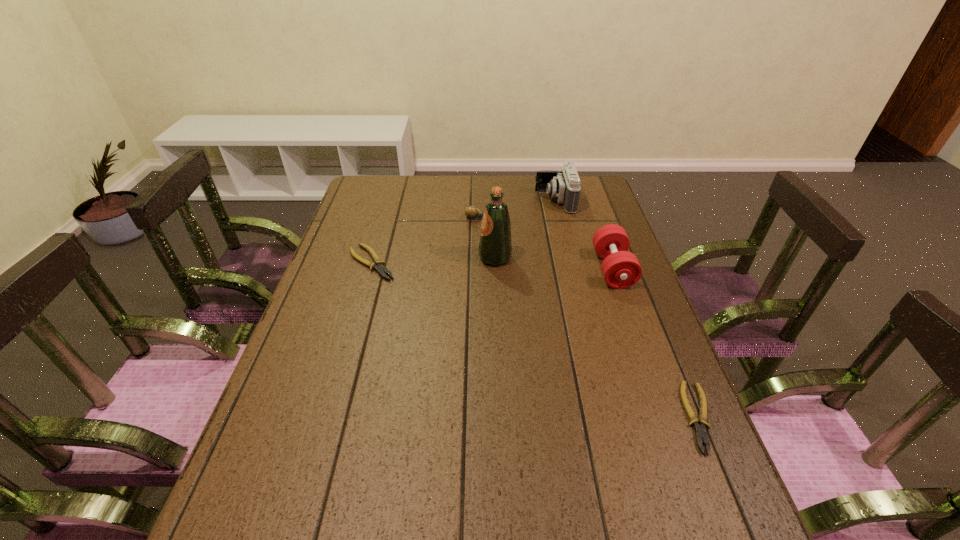
At what (x,y) coordinates should I click in order to perform the action: click on free space for an extra pliers to achieve even spacing. Please return your answer as a coordinate pair (x, y). Image resolution: width=960 pixels, height=540 pixels. Looking at the image, I should click on (507, 327).